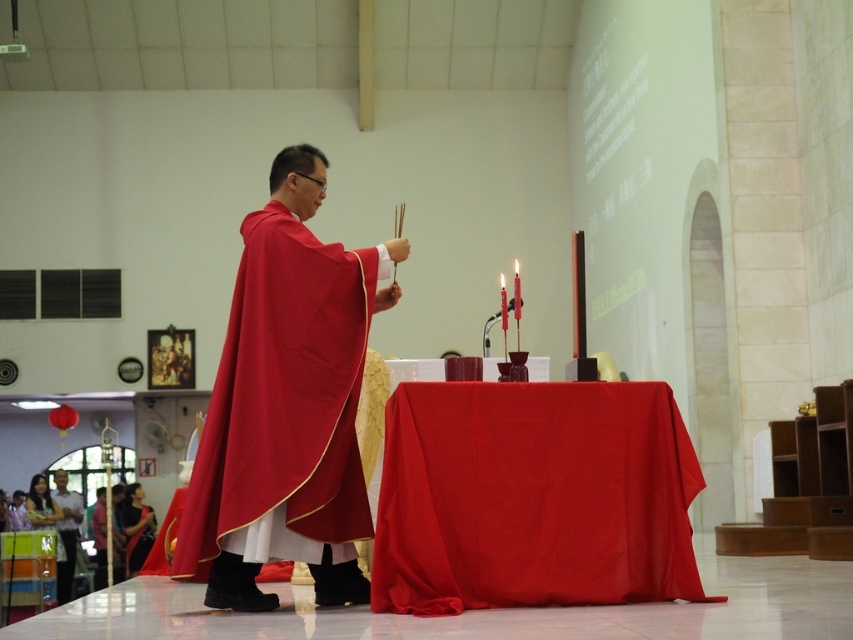
Question: Based on their relative distances, which object is nearer to the red cloth table at center?

Choices:
 (A) matte red cape at center
 (B) smooth white shirt at lower left
 (C) satin black dress at lower left

Answer: (A)

Question: Is smooth white shirt at lower left thinner than satin black dress at lower left?

Choices:
 (A) no
 (B) yes

Answer: (A)

Question: Which point is farther to the camera?

Choices:
 (A) (132, 538)
 (B) (515, 506)
 (C) (61, 600)
 (D) (277, 416)

Answer: (A)

Question: Can you confirm if red cloth table at center is smaller than matte red cape at center?

Choices:
 (A) yes
 (B) no

Answer: (A)

Question: From the image, what is the correct spatial relationship of smooth white shirt at lower left in relation to satin black dress at lower left?

Choices:
 (A) left
 (B) right

Answer: (A)

Question: Based on their relative distances, which object is nearer to the smooth white shirt at lower left?

Choices:
 (A) satin black dress at lower left
 (B) matte red cape at center

Answer: (A)